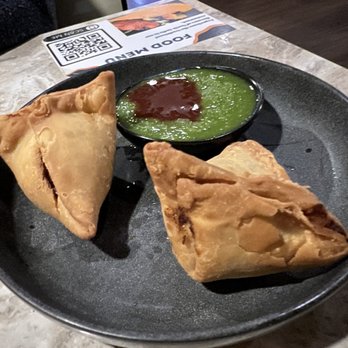
This screenshot has width=348, height=348. I want to click on table, so click(x=301, y=21).